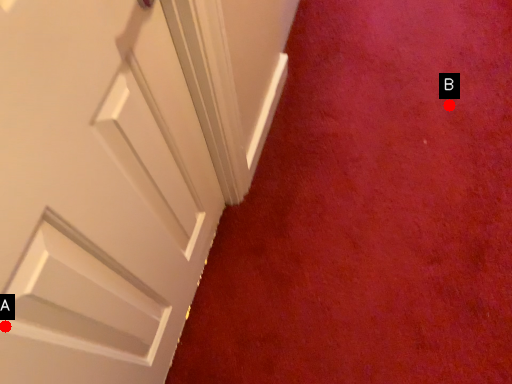
Question: Two points are circled on the image, labeled by A and B beside each circle. Which point is farther from the camera taking this photo?

Choices:
 (A) A is further
 (B) B is further

Answer: (B)